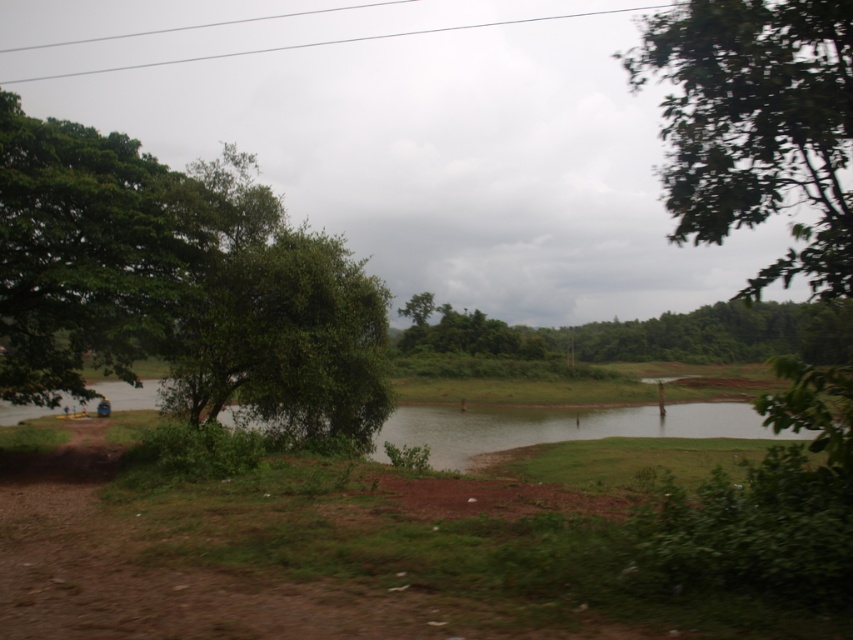
You are a GUI agent. You are given a task and a screenshot of the screen. Output one action in this format:
    pyautogui.click(x=<x>, y=<y>)
    Task: Click on the green leafy tree at upper right
    
    Given the screenshot: What is the action you would take?
    pyautogui.click(x=757, y=125)

Who is more distant from viewer, [766,192] or [509,355]?

Point [509,355]

Which is behind, point (769, 198) or point (619, 349)?

The point (619, 349) is behind.

This screenshot has width=853, height=640. I want to click on green leafy tree at upper right, so click(x=757, y=125).

Can you confirm if green leafy tree at left is positioned to the right of green leafy trees at center?

In fact, green leafy tree at left is to the left of green leafy trees at center.

Does point (351, 326) come farther from viewer compared to point (498, 340)?

That is False.

Does point (190, 220) lie behind point (817, 314)?

No, (190, 220) is in front of (817, 314).

At what (x,y) coordinates should I click in order to perform the action: click on green leafy tree at left. Please return your answer as a coordinate pair (x, y). Image resolution: width=853 pixels, height=640 pixels. Looking at the image, I should click on (177, 284).

Who is higher up, green leafy tree at left or green leafy tree at upper right?

green leafy tree at upper right

Measure the distance between green leafy tree at left and green leafy tree at upper right.

A distance of 61.64 feet exists between green leafy tree at left and green leafy tree at upper right.

Is point (136, 212) positioned behind point (764, 16)?

Yes, it is behind point (764, 16).

Where is `green leafy tree at left`? green leafy tree at left is located at coordinates (177, 284).